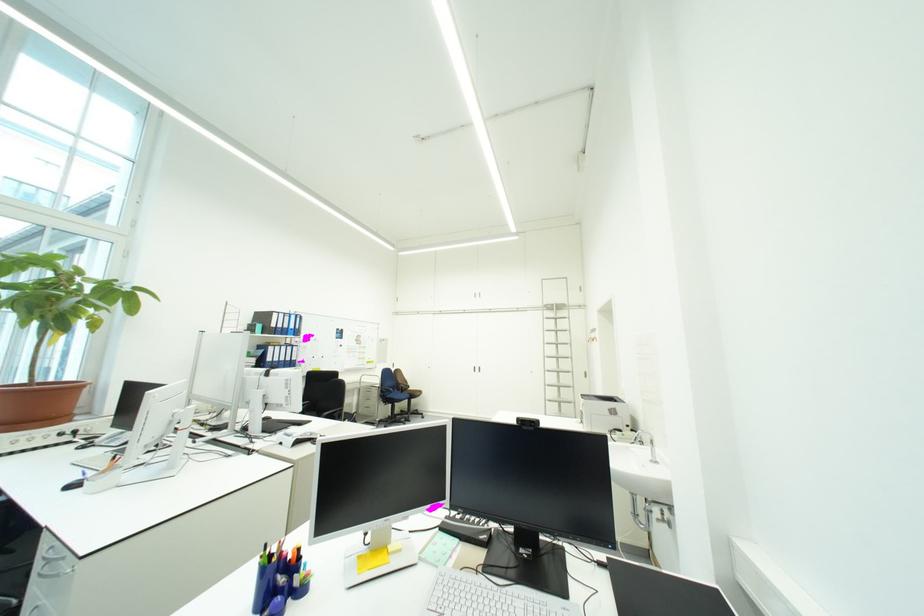
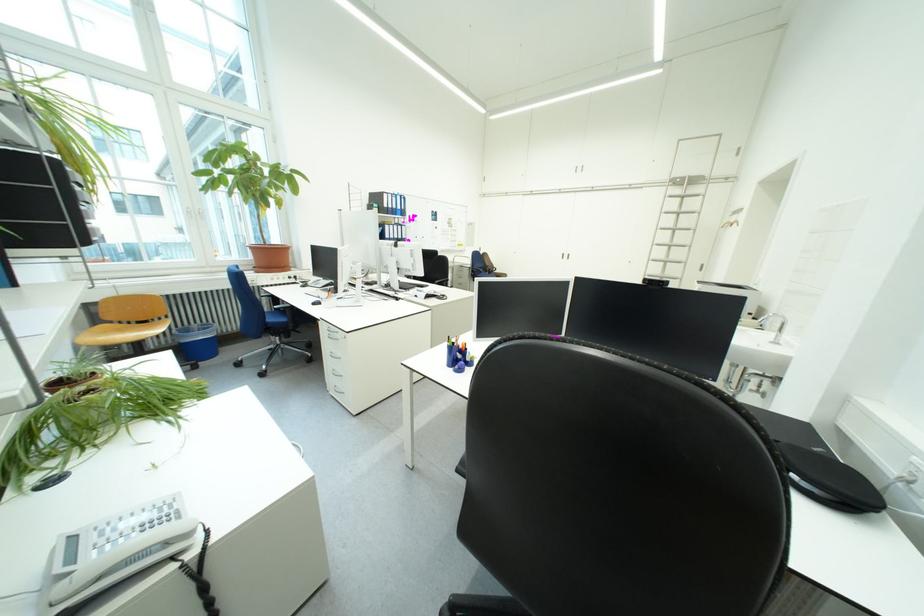
Find the pixel in the second image that matches the point at 572,355 in the first image.

(687, 244)